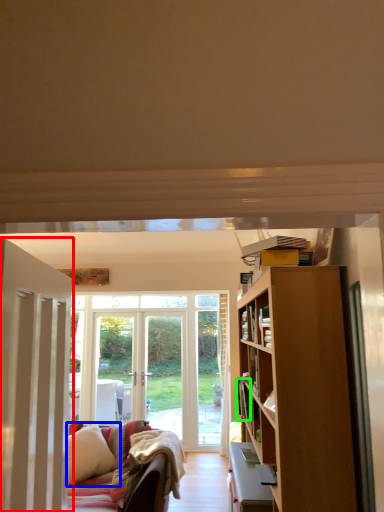
Question: Which is nearer to the door (highlighted by a red box)? pillow (highlighted by a blue box) or book (highlighted by a green box).

Choices:
 (A) pillow
 (B) book

Answer: (B)